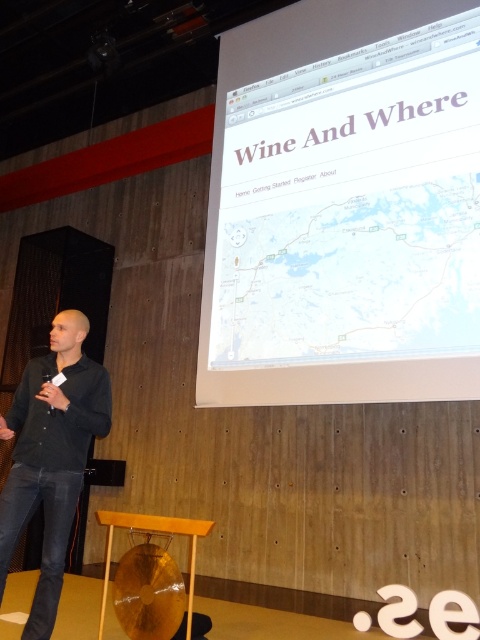
You are an attendee at the presentation and notice the white paper at upper center and the black matte shirt at left. Which object appears taller in the image?

The white paper at upper center is taller than the black matte shirt at left.

You are an attendee at the presentation and want to take notes. You see the white paper at upper center and the black matte shirt at left. Which object is located to the right of the other?

The white paper at upper center is positioned on the right side of black matte shirt at left.

You are an attendee at the presentation. You notice the white paper at upper center and the black matte shirt at left. Which object is bigger in size?

The white paper at upper center is larger in size than the black matte shirt at left.